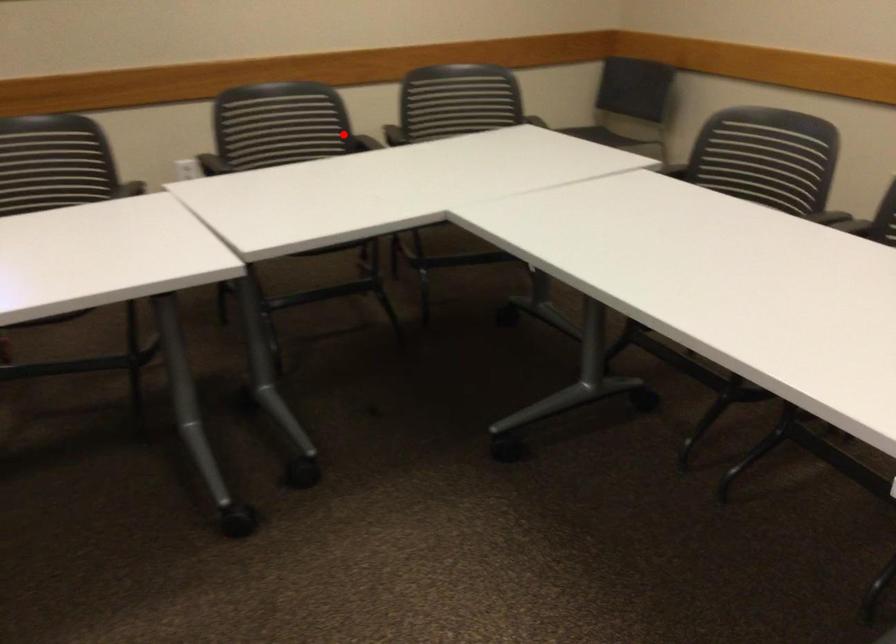
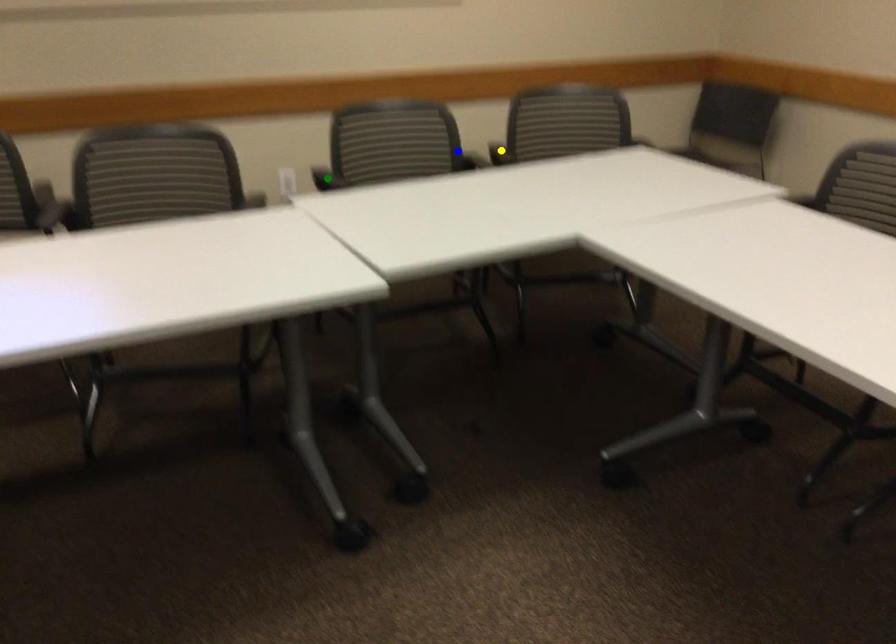
Question: I am providing you with two images of the same scene from different viewpoints. A red point is marked on the first image. You are given multiple points on the second image. Can you choose the point in image 2 that corresponds to the point in image 1?

Choices:
 (A) blue point
 (B) yellow point
 (C) green point

Answer: (A)